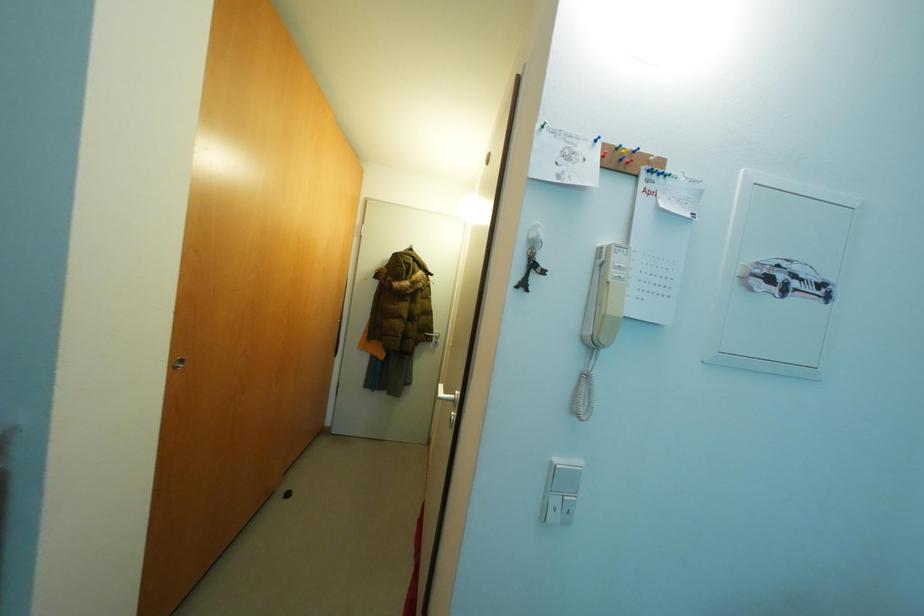
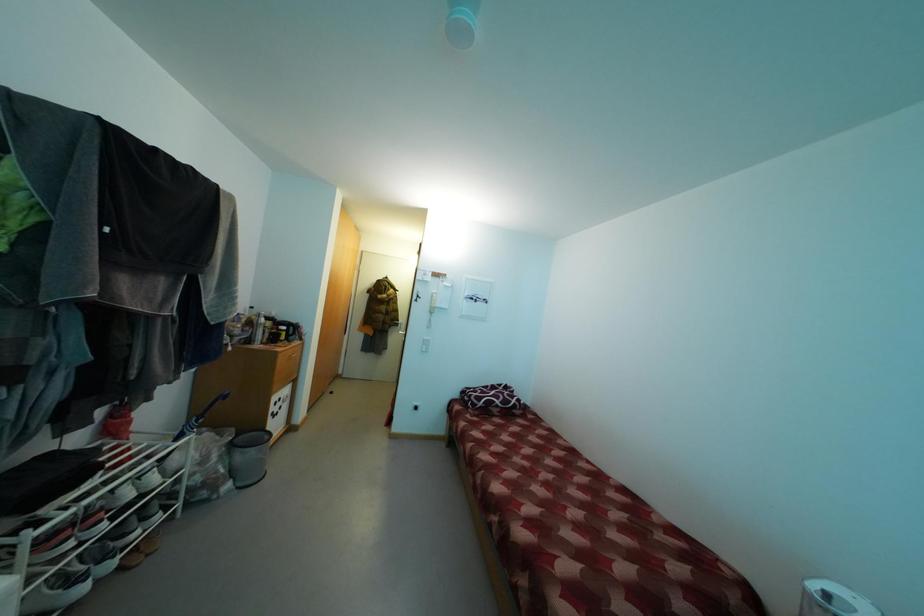
Question: In a continuous first-person perspective shot, in which direction is the camera moving?

Choices:
 (A) Left
 (B) Right
 (C) Forward
 (D) Backward

Answer: (D)